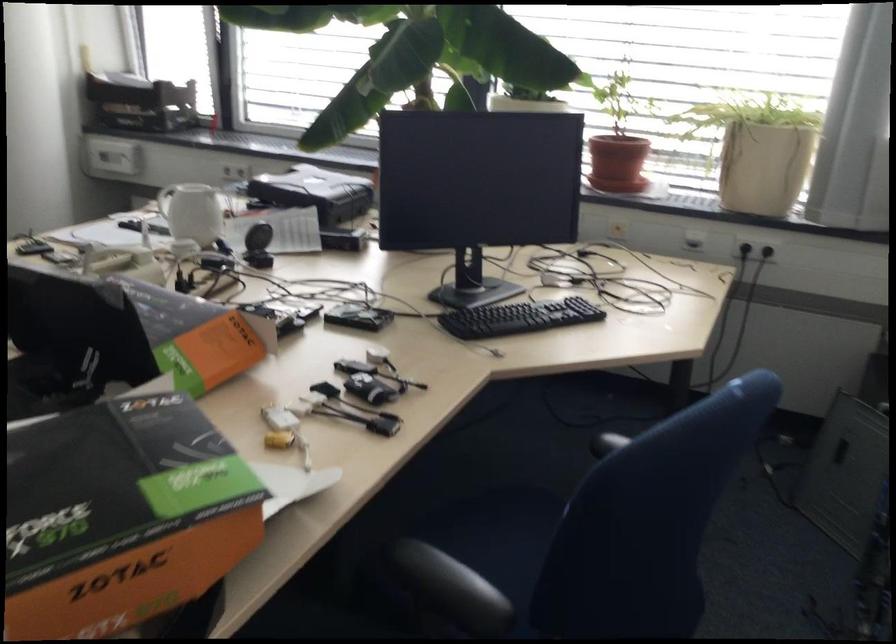
Find the location of `white pitcher handle`. white pitcher handle is located at coordinates (165, 200).